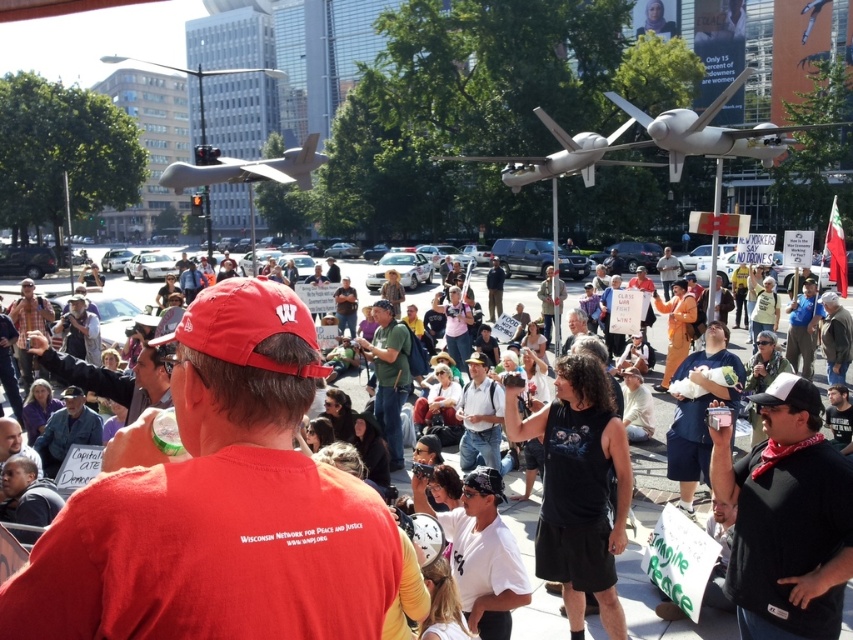
Which is in front, point (297, 177) or point (80, 401)?

Point (80, 401) is more forward.

Does matte gray drone at center appear under matte black crowd at center?

No, matte gray drone at center is not below matte black crowd at center.

Is point (321, 157) closer to camera compared to point (143, 349)?

No.

I want to click on matte gray drone at center, so 248,168.

Who is positioned more to the left, white matte drone at upper center or matte gray drone at center?

matte gray drone at center is more to the left.

Is white matte drone at upper center to the left of matte gray drone at center from the viewer's perspective?

No, white matte drone at upper center is not to the left of matte gray drone at center.

Where is `white matte drone at upper center`? white matte drone at upper center is located at coordinates (648, 141).

Where is `white matte drone at upper center`? Image resolution: width=853 pixels, height=640 pixels. white matte drone at upper center is located at coordinates (648, 141).

Between white matte drone at upper center and matte black crowd at center, which one is positioned lower?

matte black crowd at center is below.

Is white matte drone at upper center further to the viewer compared to matte black crowd at center?

That is True.

Is point (659, 147) positioned after point (151, 394)?

Yes, it is.

This screenshot has width=853, height=640. Find the location of `white matte drone at upper center`. white matte drone at upper center is located at coordinates (648, 141).